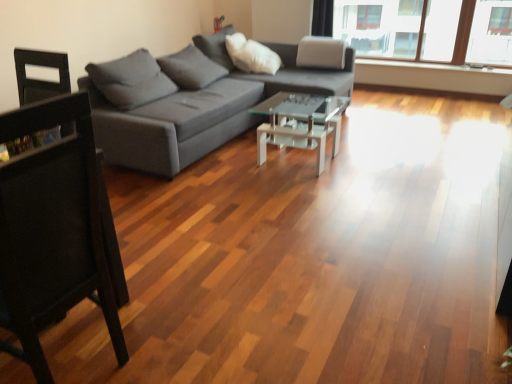
Question: Does transparent glass coffee table at center have a smaller size compared to black wood chair at left?

Choices:
 (A) no
 (B) yes

Answer: (B)

Question: Does transparent glass coffee table at center come in front of black wood chair at left?

Choices:
 (A) no
 (B) yes

Answer: (A)

Question: Is black wood chair at left at the back of transparent glass coffee table at center?

Choices:
 (A) yes
 (B) no

Answer: (B)

Question: Is the surface of transparent glass coffee table at center in direct contact with black wood chair at left?

Choices:
 (A) no
 (B) yes

Answer: (A)

Question: Considering the relative sizes of transparent glass coffee table at center and black wood chair at left in the image provided, is transparent glass coffee table at center bigger than black wood chair at left?

Choices:
 (A) no
 (B) yes

Answer: (A)

Question: From the image's perspective, is transparent glass coffee table at center on black wood chair at left?

Choices:
 (A) no
 (B) yes

Answer: (B)

Question: Considering the relative sizes of gray fabric couch at center and black wood chair at left in the image provided, is gray fabric couch at center bigger than black wood chair at left?

Choices:
 (A) yes
 (B) no

Answer: (A)

Question: Is gray fabric couch at center closer to the viewer compared to black wood chair at left?

Choices:
 (A) yes
 (B) no

Answer: (B)

Question: Considering the relative sizes of gray fabric couch at center and black wood chair at left in the image provided, is gray fabric couch at center thinner than black wood chair at left?

Choices:
 (A) yes
 (B) no

Answer: (B)

Question: Is gray fabric couch at center to the right of black wood chair at left from the viewer's perspective?

Choices:
 (A) no
 (B) yes

Answer: (B)

Question: Is gray fabric couch at center taller than black wood chair at left?

Choices:
 (A) no
 (B) yes

Answer: (A)

Question: From a real-world perspective, is gray fabric couch at center over black wood chair at left?

Choices:
 (A) no
 (B) yes

Answer: (A)

Question: From a real-world perspective, is black wood chair at left on gray fabric couch at center?

Choices:
 (A) no
 (B) yes

Answer: (B)